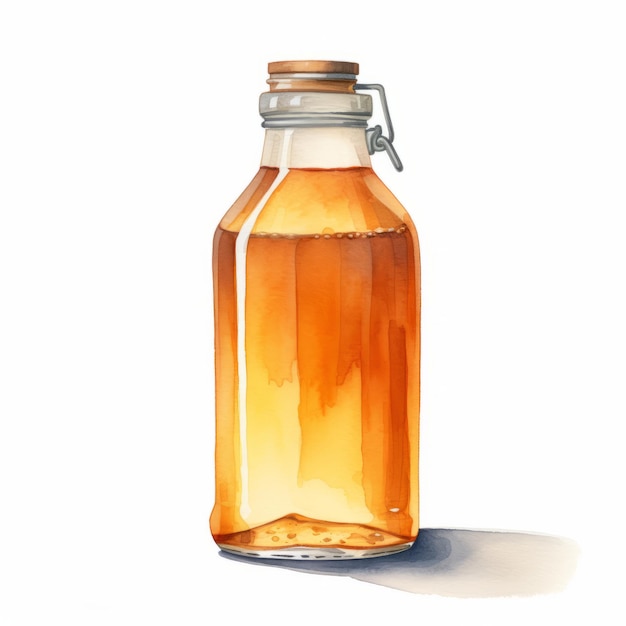
Where is `bottle`? This screenshot has height=626, width=626. bottle is located at coordinates (314, 263).